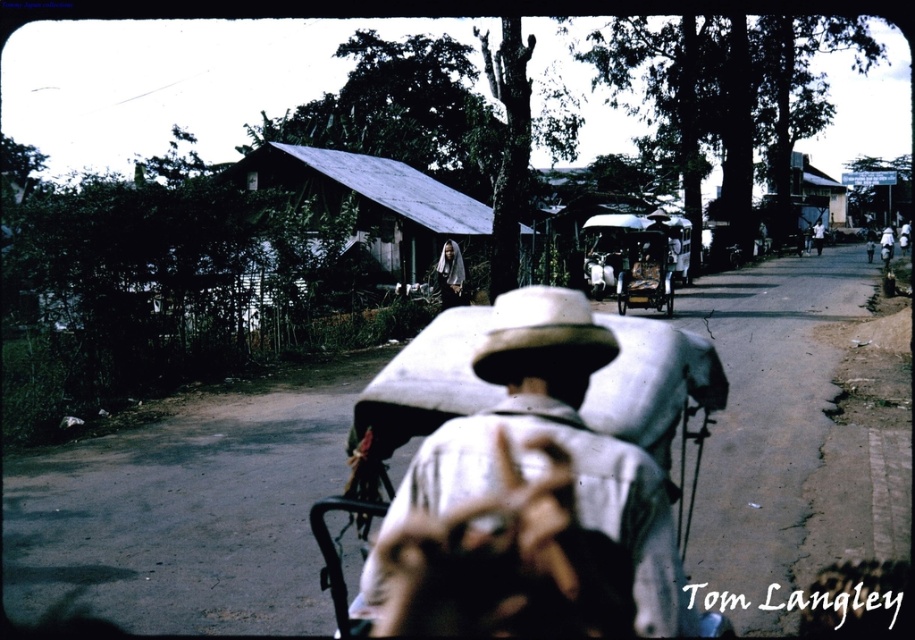
You are a photographer trying to capture a clear shot of the metallic corrugated roof at center and the white fabric cowboy hat at center. If you want to frame both objects in your camera, which object should you adjust your focus to prioritize based on their sizes?

The metallic corrugated roof at center is wider than the white fabric cowboy hat at center. Therefore, to frame both, prioritize focusing on the metallic corrugated roof at center as it takes up more space in the frame.

You are a photographer trying to capture the person in the rural street scene. You notice two white items on their head. Which one is positioned lower on the head between the white fabric cowboy hat at center and the white cloth headscarf at center?

The white fabric cowboy hat at center is positioned lower on the head than the white cloth headscarf at center, as it is located below it.

You are a photographer trying to capture a clear image of both the white fabric cowboy hat at center and the white cloth headscarf at center. Which object is located to the right of the other?

The white fabric cowboy hat at center is positioned on the right side of white cloth headscarf at center.